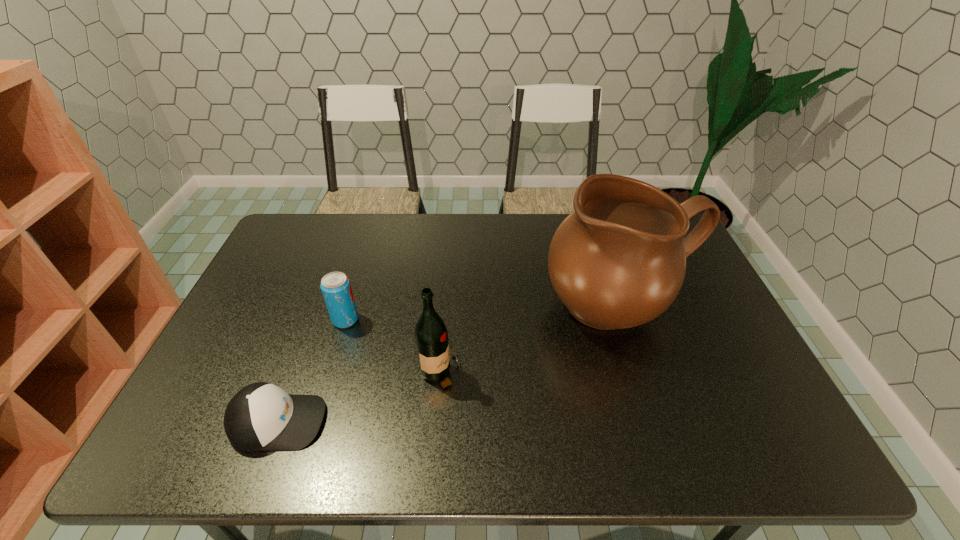
Locate an element on the screen. vacant region at the near left corner of the desktop is located at coordinates (204, 444).

Where is `vacant space in between the second nearest object and the second shortest object`? Image resolution: width=960 pixels, height=540 pixels. vacant space in between the second nearest object and the second shortest object is located at coordinates (394, 347).

The image size is (960, 540). Find the location of `unoccupied position between the third tallest object and the nearest object`. unoccupied position between the third tallest object and the nearest object is located at coordinates (312, 370).

Identify the location of free spot between the tallest object and the soda can. (483, 313).

You are a GUI agent. You are given a task and a screenshot of the screen. Output one action in this format:
    pyautogui.click(x=<x>, y=<y>)
    Task: Click on the free space between the second shortest object and the third farthest object
    
    Given the screenshot: What is the action you would take?
    pos(394,347)

Where is `free space between the rightmost object and the second object from right to left`? The width and height of the screenshot is (960, 540). free space between the rightmost object and the second object from right to left is located at coordinates (531, 341).

Identify the location of free space between the cream pitcher and the third tallest object. The height and width of the screenshot is (540, 960). (483, 313).

Find the location of a particular element. The image size is (960, 540). empty space that is in between the second shortest object and the cream pitcher is located at coordinates (483, 313).

Find the location of a particular element. This screenshot has height=540, width=960. unoccupied position between the nearest object and the soda can is located at coordinates (312, 370).

Identify which object is the third nearest to the third farthest object. Please provide its 2D coordinates. Your answer should be formatted as a tuple, i.e. [(x, y)], where the tuple contains the x and y coordinates of a point satisfying the conditions above.

[(618, 261)]